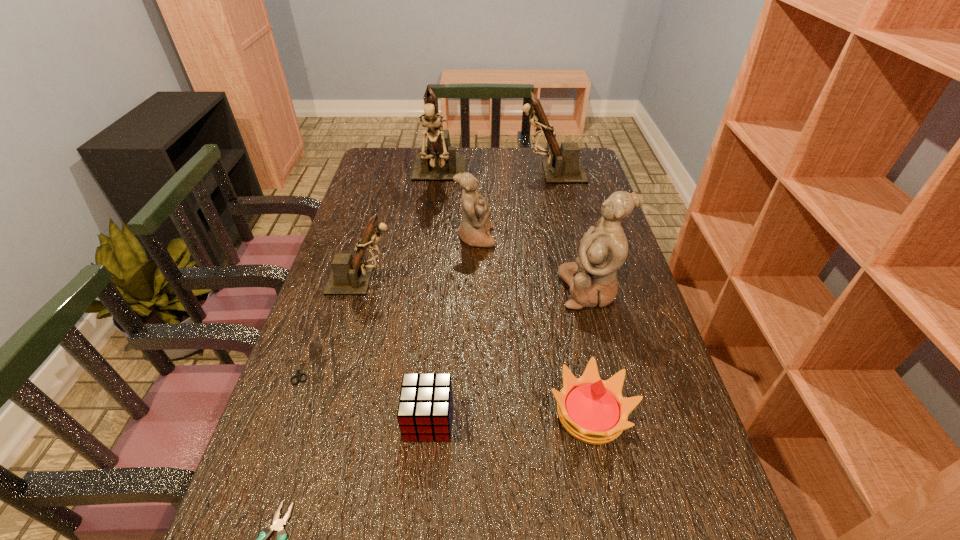
The width and height of the screenshot is (960, 540). I want to click on free space between the biggest brown figurine and the rightmost brown figurine, so click(495, 174).

Find the location of `free spot between the black shears and the right white figurine`. free spot between the black shears and the right white figurine is located at coordinates (445, 328).

Find the location of a particular element. This screenshot has width=960, height=540. the fifth closest object to the tallest object is located at coordinates (298, 375).

The width and height of the screenshot is (960, 540). I want to click on the third closest object to the cube, so click(298, 375).

Where is `figurine that stands as the third closest to the biggest brown figurine`? The width and height of the screenshot is (960, 540). figurine that stands as the third closest to the biggest brown figurine is located at coordinates (350, 275).

At what (x,y) coordinates should I click in order to perform the action: click on figurine that is the second nearest to the shortest object. Please return your answer as a coordinate pair (x, y). Looking at the image, I should click on (474, 230).

This screenshot has width=960, height=540. In order to click on the closest brown figurine relative to the second biggest brown figurine in this screenshot , I will do `click(438, 161)`.

Locate an element on the screen. the second closest brown figurine to the red cube is located at coordinates (438, 161).

The width and height of the screenshot is (960, 540). Find the location of `vacant region that satisfies the following two spatial constraints: 1. on the front-facing side of the rightmost brown figurine; 2. on the front-facing side of the biggest brown figurine`. vacant region that satisfies the following two spatial constraints: 1. on the front-facing side of the rightmost brown figurine; 2. on the front-facing side of the biggest brown figurine is located at coordinates (552, 176).

This screenshot has height=540, width=960. Find the location of `free space that satisfies the following two spatial constraints: 1. on the front-facing side of the tallest object; 2. on the front-facing side of the smallest brown figurine`. free space that satisfies the following two spatial constraints: 1. on the front-facing side of the tallest object; 2. on the front-facing side of the smallest brown figurine is located at coordinates (425, 280).